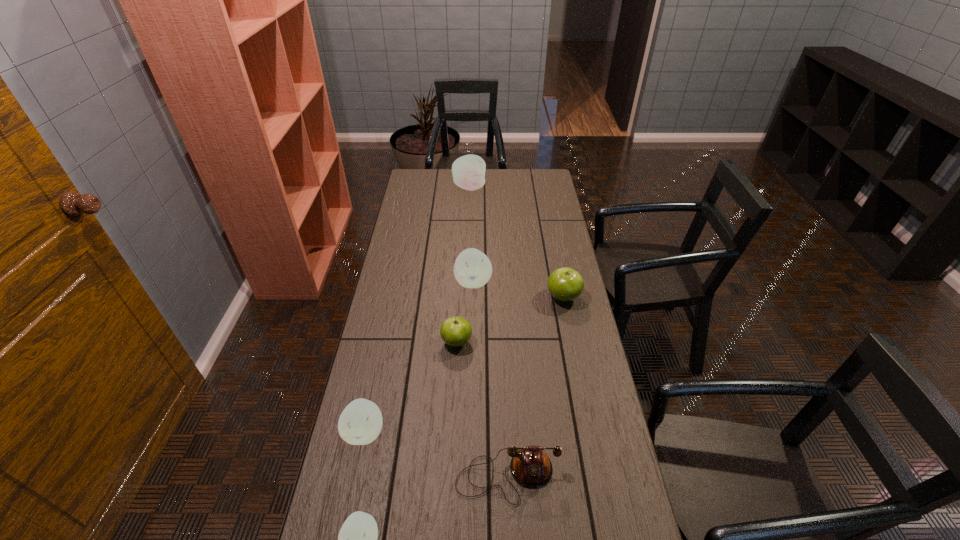
At what (x,y) coordinates should I click in order to perform the action: click on the tallest apple. Please return your answer as a coordinate pair (x, y). This screenshot has height=540, width=960. Looking at the image, I should click on (468, 171).

Where is `the farthest white apple`? The image size is (960, 540). the farthest white apple is located at coordinates (468, 171).

The image size is (960, 540). Find the location of `the third smallest white apple`. the third smallest white apple is located at coordinates (472, 269).

Image resolution: width=960 pixels, height=540 pixels. Identify the location of the farther green apple. (565, 284).

Identify the location of the right green apple. (565, 284).

Identify the location of the second nearest white apple. This screenshot has height=540, width=960. (360, 423).

Identify the location of the fifth farthest apple. (360, 423).

This screenshot has width=960, height=540. I want to click on the third nearest apple, so click(456, 331).

Identify the location of the nearer green apple. (456, 331).

Identify the location of telephone. (531, 468).